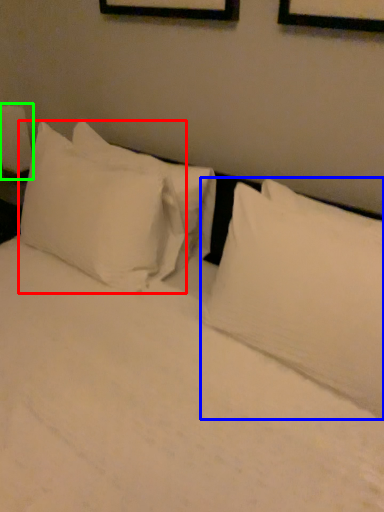
Question: Which is nearer to the pillow (highlighted by a red box)? pillow (highlighted by a blue box) or bedside lamp (highlighted by a green box).

Choices:
 (A) pillow
 (B) bedside lamp

Answer: (A)